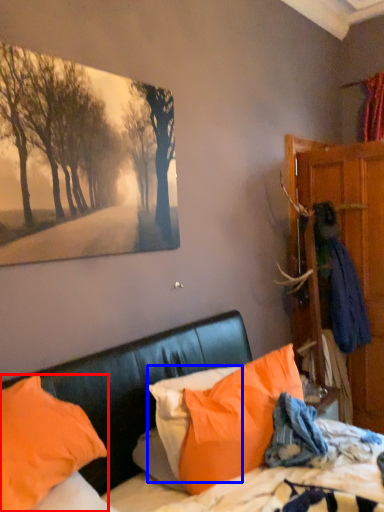
Question: Which object is further to the camera taking this photo, pillow (highlighted by a red box) or pillow (highlighted by a blue box)?

Choices:
 (A) pillow
 (B) pillow

Answer: (B)